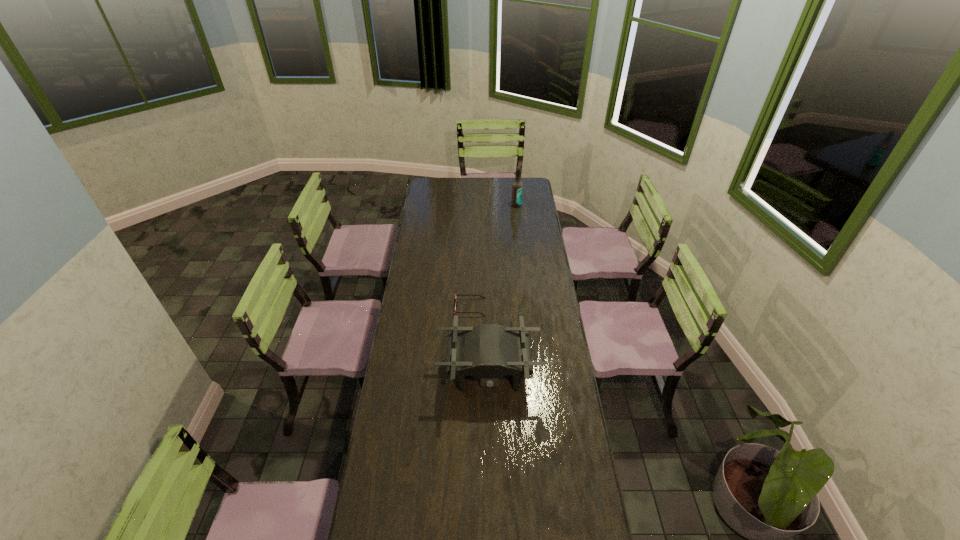
The image size is (960, 540). In order to click on drone that is at the right edge in this screenshot , I will do `click(488, 351)`.

This screenshot has width=960, height=540. What are the coordinates of `free spot at the far edge of the desktop` in the screenshot? It's located at (493, 178).

This screenshot has height=540, width=960. Find the location of `vacant space at the left edge of the desktop`. vacant space at the left edge of the desktop is located at coordinates (386, 406).

Identify the location of blank space at the right edge of the desktop. The height and width of the screenshot is (540, 960). (532, 258).

Where is `free space between the drone and the tallest object`? The image size is (960, 540). free space between the drone and the tallest object is located at coordinates 502,288.

You are a GUI agent. You are given a task and a screenshot of the screen. Output one action in this format:
    pyautogui.click(x=<x>, y=<y>)
    Task: Click on the vacant space that is in between the farthest object and the nearest object
    The image size is (960, 540).
    Given the screenshot: What is the action you would take?
    pyautogui.click(x=502, y=288)

Identify the location of free spot between the drone and the farthest object. (502, 288).

Identify which object is the nearest to the nearest object. Please provide its 2D coordinates. Your answer should be formatted as a tuple, i.e. [(x, y)], where the tuple contains the x and y coordinates of a point satisfying the conditions above.

[(456, 295)]

The height and width of the screenshot is (540, 960). In order to click on the closest object relative to the second shortest object in this screenshot , I will do `click(456, 295)`.

Locate an element on the screen. free space in the image that satisfies the following two spatial constraints: 1. on the label of the tallest object; 2. on the bridge of the second farthest object is located at coordinates (528, 307).